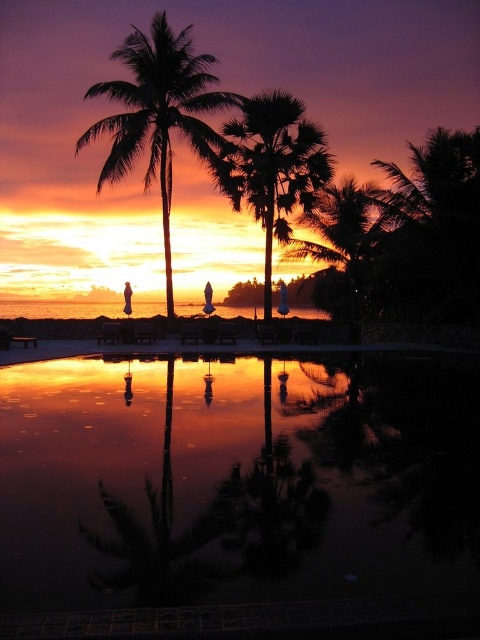
Question: Which object is farther from the camera taking this photo?

Choices:
 (A) green leafy palm tree at center
 (B) silhouette leafy palm at center
 (C) silhouette palm tree at center

Answer: (A)

Question: Considering the relative positions of reflective glass pool at center and green leafy palm tree at center in the image provided, where is reflective glass pool at center located with respect to green leafy palm tree at center?

Choices:
 (A) above
 (B) below

Answer: (B)

Question: Estimate the real-world distances between objects in this image. Which object is closer to the silhouette palm tree at center?

Choices:
 (A) reflective glass pool at center
 (B) white cotton dress at center
 (C) dark green leafy palm tree at upper right
 (D) silhouette leafy palm at center

Answer: (B)

Question: Can you confirm if dark green leafy palm tree at upper right is positioned below silhouette leafy palm at center?

Choices:
 (A) no
 (B) yes

Answer: (A)

Question: Which object is positioned farthest from the green leafy palm tree at center?

Choices:
 (A) white cotton dress at center
 (B) dark green leafy palm tree at upper right
 (C) reflective glass pool at center
 (D) silhouette palm tree at center

Answer: (C)

Question: Does silhouette palm tree at center appear on the right side of silhouette leafy palm at center?

Choices:
 (A) yes
 (B) no

Answer: (B)